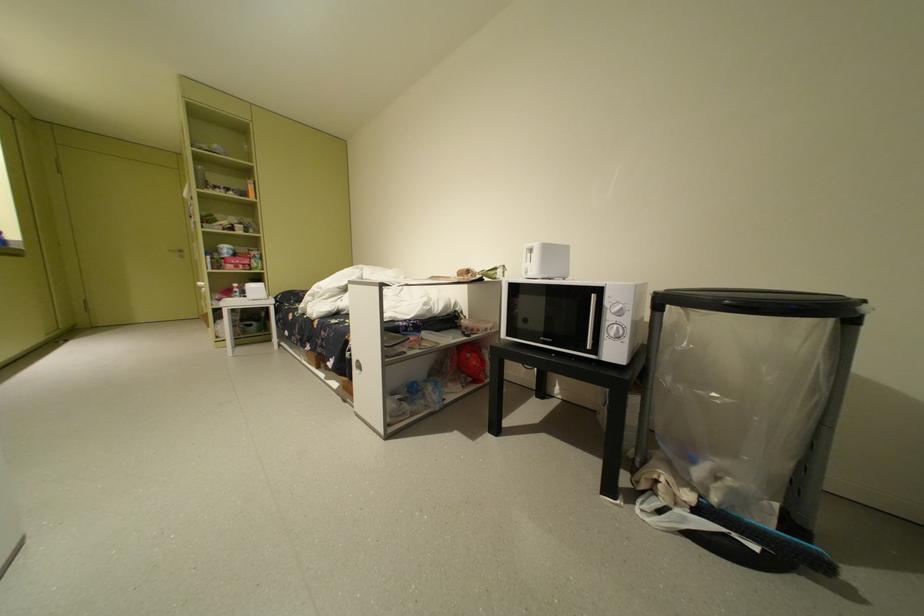
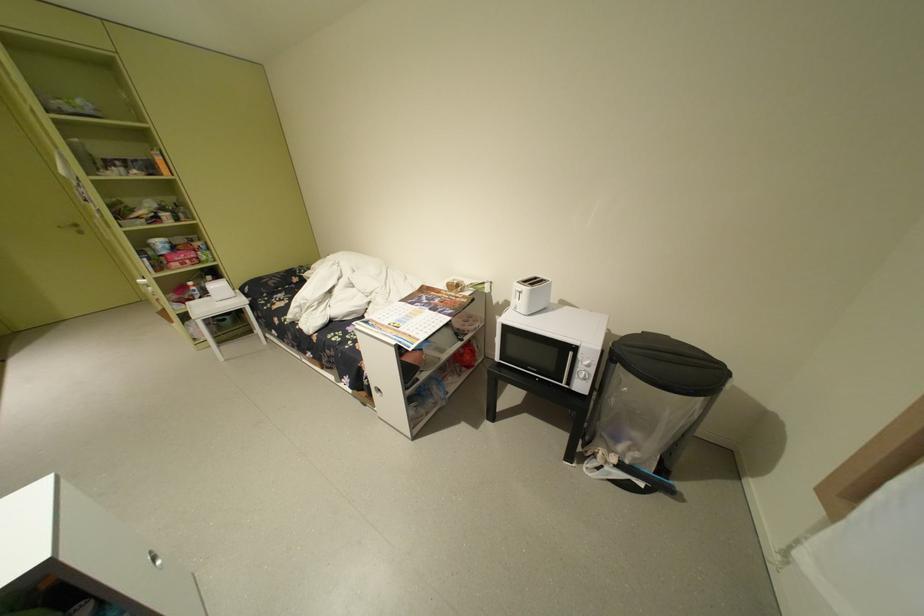
Locate, in the second image, the point that corresponds to the point at 604,296 in the first image.

(581, 354)